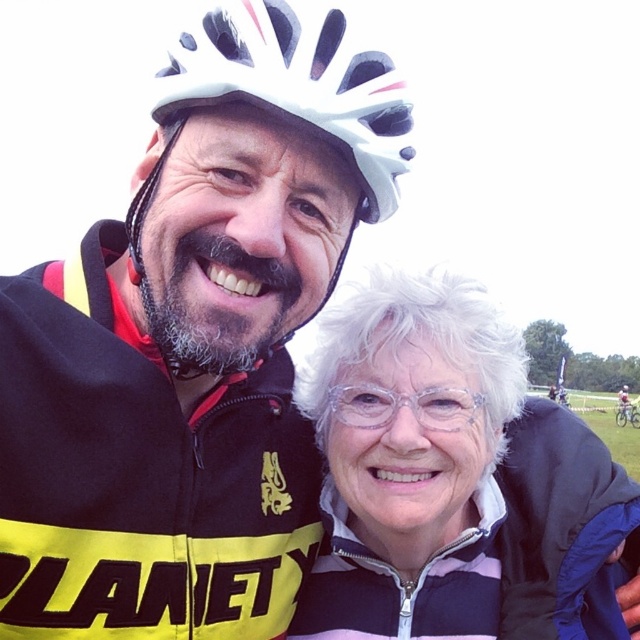
Question: Is white textured hair at center to the right of clear plastic glasses at center from the viewer's perspective?

Choices:
 (A) no
 (B) yes

Answer: (B)

Question: Does white textured hair at center come in front of clear plastic glasses at center?

Choices:
 (A) no
 (B) yes

Answer: (A)

Question: Among these objects, which one is farthest from the camera?

Choices:
 (A) clear plastic glasses at center
 (B) white matte bicycle helmet at upper center
 (C) white textured hair at center

Answer: (C)

Question: Based on their relative distances, which object is farther from the white textured hair at center?

Choices:
 (A) clear plastic glasses at center
 (B) white matte bicycle helmet at upper center

Answer: (B)

Question: Is white matte bicycle helmet at upper center behind clear plastic glasses at center?

Choices:
 (A) no
 (B) yes

Answer: (A)

Question: Which object is farther from the camera taking this photo?

Choices:
 (A) white textured hair at center
 (B) clear plastic glasses at center

Answer: (A)